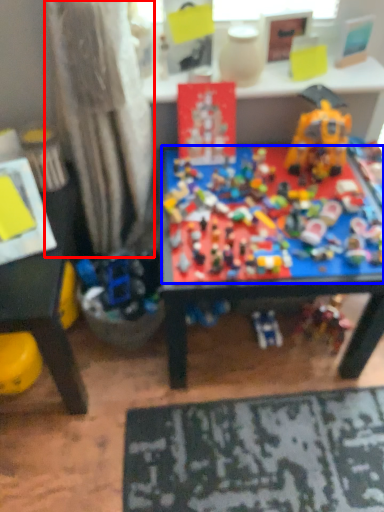
Question: Which object is closer to the camera taking this photo, curtain (highlighted by a red box) or toy (highlighted by a blue box)?

Choices:
 (A) curtain
 (B) toy

Answer: (A)